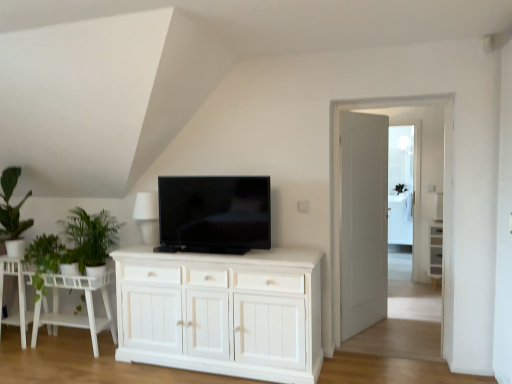
Question: From a real-world perspective, is white wood side table at lower left, acting as the 2th table starting from the right, physically located above or below white wood cabinet at right?

Choices:
 (A) below
 (B) above

Answer: (A)

Question: From their relative heights in the image, would you say white wood side table at lower left, the first table from the left, is taller or shorter than white wood cabinet at right?

Choices:
 (A) tall
 (B) short

Answer: (B)

Question: Which object is positioned farthest from the green leafy plant at left, which is the second plant from right to left?

Choices:
 (A) green leafy plant at left, placed as the 2th plant when sorted from left to right
 (B) green matte plant at left
 (C) white wooden door at center
 (D) white matte lampshade at upper center
 (E) transparent glass door at center, which appears as the 2th glass door when viewed from the left

Answer: (E)

Question: Estimate the real-world distances between objects in this image. Which object is farther from the white wood table at lower left, which is the 1th table in right-to-left order?

Choices:
 (A) transparent glass door at center, the first glass door positioned from the right
 (B) green matte plant at left
 (C) black glossy tv at center
 (D) green leafy plant at left, the first plant in the left-to-right sequence
 (E) white matte lampshade at upper center

Answer: (A)